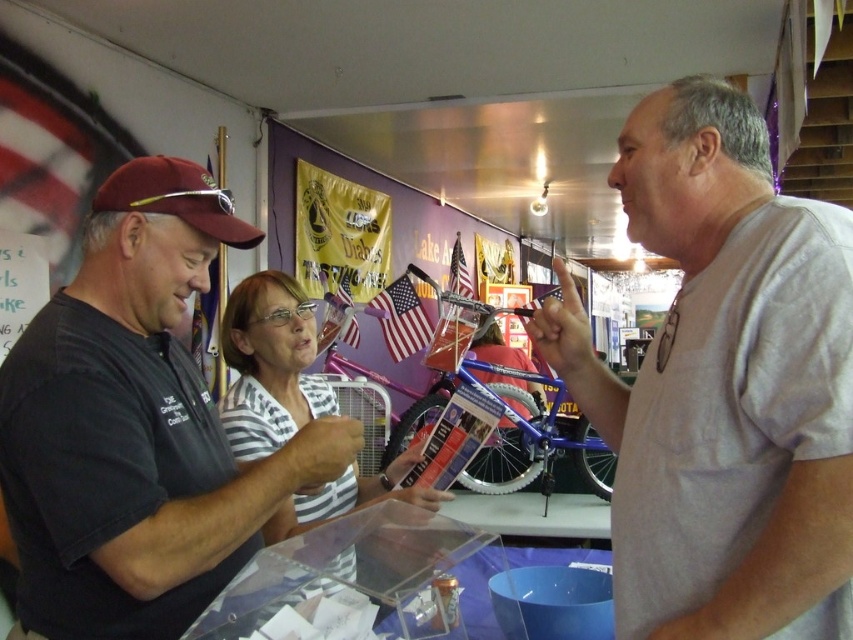
Question: Estimate the real-world distances between objects in this image. Which object is farther from the maroon fabric baseball cap at left?

Choices:
 (A) white striped shirt at center
 (B) dark gray t-shirt at center

Answer: (A)

Question: Which object is the farthest from the maroon fabric baseball cap at left?

Choices:
 (A) white striped shirt at center
 (B) gray cotton t-shirt at right

Answer: (B)

Question: Which object is the closest to the dark gray t-shirt at center?

Choices:
 (A) white striped shirt at center
 (B) maroon fabric baseball cap at left
 (C) gray cotton t-shirt at right

Answer: (B)

Question: Can you confirm if gray cotton t-shirt at right is positioned above dark gray t-shirt at center?

Choices:
 (A) yes
 (B) no

Answer: (A)

Question: Can you confirm if white striped shirt at center is positioned to the right of maroon fabric baseball cap at left?

Choices:
 (A) yes
 (B) no

Answer: (A)

Question: Can you confirm if gray cotton t-shirt at right is positioned below white striped shirt at center?

Choices:
 (A) yes
 (B) no

Answer: (B)